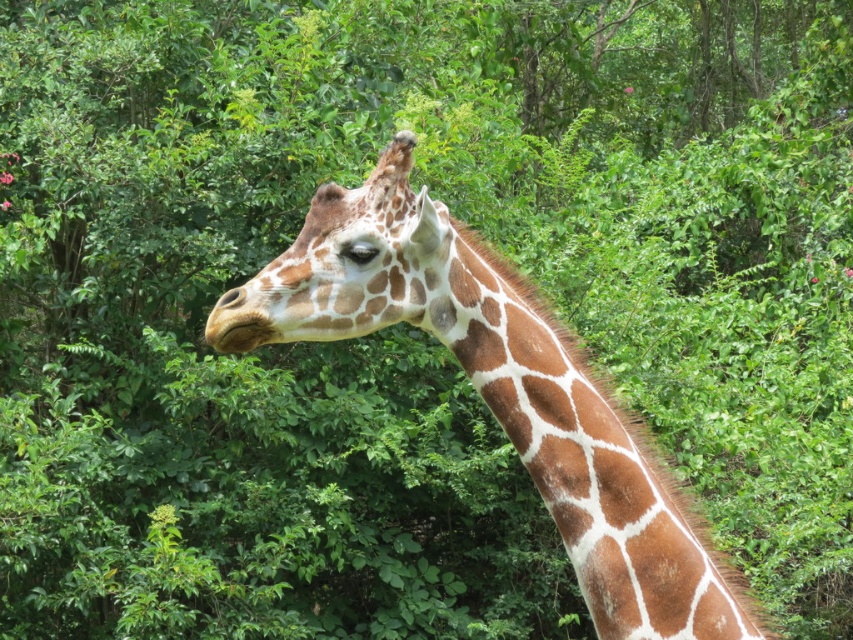
Question: Is brown spotted fur at center bigger than brown textured neck at center?

Choices:
 (A) no
 (B) yes

Answer: (B)

Question: Which point is closer to the camera?

Choices:
 (A) (403, 144)
 (B) (618, 445)
 (C) (337, 333)

Answer: (A)

Question: Is brown textured neck at center below brown spotted skin at center?

Choices:
 (A) yes
 (B) no

Answer: (A)

Question: Which object is the farthest from the brown spotted fur at center?

Choices:
 (A) brown textured neck at center
 (B) brown spotted skin at center

Answer: (B)

Question: Which point is farther to the camera?

Choices:
 (A) brown textured neck at center
 (B) brown spotted skin at center

Answer: (B)

Question: Does brown spotted fur at center lie in front of brown spotted skin at center?

Choices:
 (A) no
 (B) yes

Answer: (B)